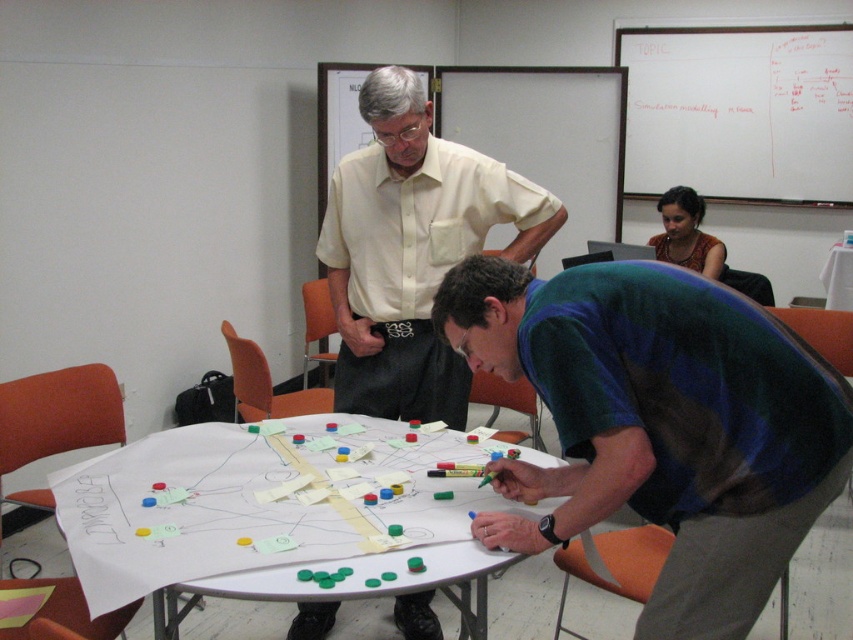
Question: Estimate the real-world distances between objects in this image. Which object is farther from the white paper at center?

Choices:
 (A) light beige shirt at center
 (B) green fabric shirt at center

Answer: (A)

Question: Can you confirm if green fabric shirt at center is positioned to the left of whiteboard at upper center?

Choices:
 (A) yes
 (B) no

Answer: (A)

Question: Does green fabric shirt at center have a lesser width compared to white paper at center?

Choices:
 (A) no
 (B) yes

Answer: (B)

Question: Does white paper at center have a greater width compared to whiteboard at upper center?

Choices:
 (A) no
 (B) yes

Answer: (A)

Question: Which object appears farthest from the camera in this image?

Choices:
 (A) whiteboard at upper center
 (B) light beige shirt at center
 (C) green fabric shirt at center

Answer: (A)

Question: Based on their relative distances, which object is nearer to the light beige shirt at center?

Choices:
 (A) whiteboard at upper center
 (B) white paper at center
 (C) green fabric shirt at center
 (D) brown fabric shirt at upper center

Answer: (B)